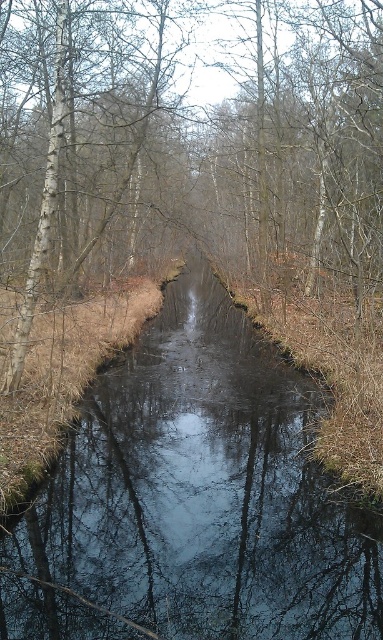
You are standing at the edge of the waterway and want to place a small floating decoration on the surface of the dark reflective water at center. However, there is a brown smooth tree at center in the way. Can you place the decoration directly in front of you without moving the tree?

The dark reflective water at center is closer to the viewer than the brown smooth tree at center, so yes, you can place the decoration on the dark reflective water at center directly in front of you since it is nearer to you than the tree.

You are standing at the edge of the stream and notice both the dark reflective water at center and the brown smooth tree at center. Which object is positioned more to the east if the stream flows from north to south?

The dark reflective water at center is to the right of the brown smooth tree at center. Since the stream flows from north to south, the right side would correspond to the east direction. Therefore, the dark reflective water at center is positioned more to the east.

You are standing at the edge of the waterway and want to cross it using a small wooden plank. The plank is exactly 1 meter long. The dark reflective water at center is located at point 0.767, 0.533. Can you place the plank horizontally across the waterway to safely cross?

The dark reflective water at center is located at point (x=204, y=490), but without knowing the distance between the banks, it is impossible to determine if the 1 meter plank will span the waterway. More information is needed about the width of the stream at that point.